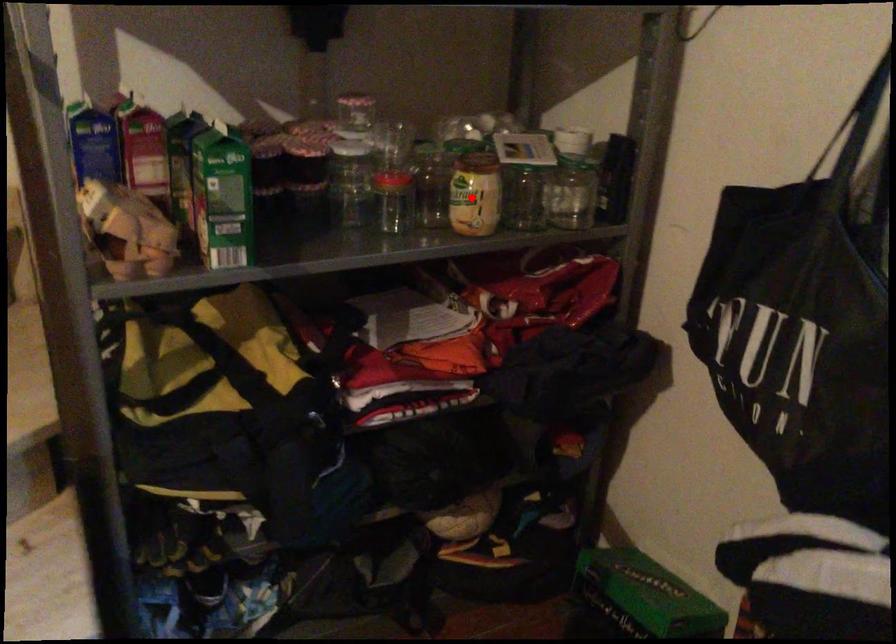
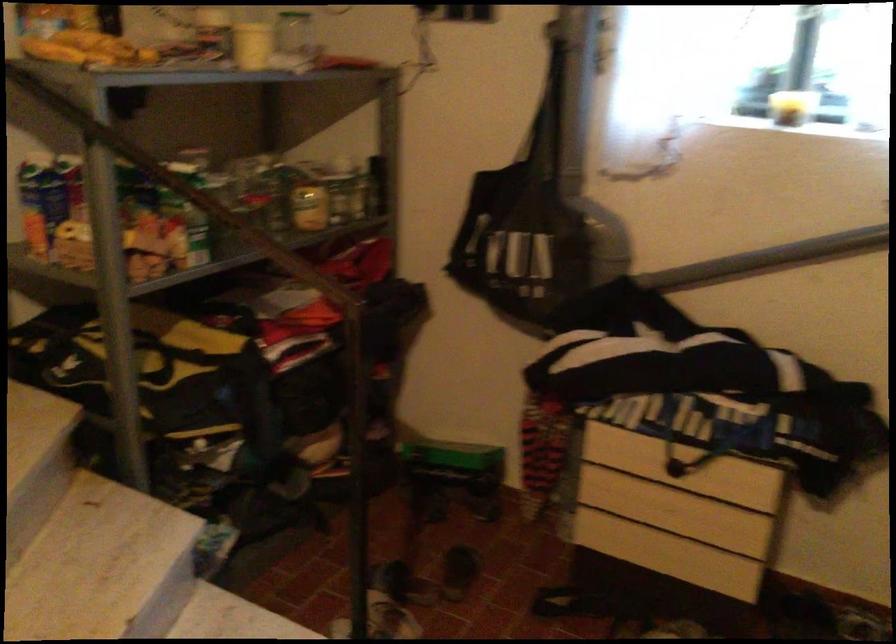
Question: I am providing you with two images of the same scene from different viewpoints. A red point is marked on the first image. Is the red point's position out of view in image 2?

Choices:
 (A) Yes
 (B) No

Answer: (B)